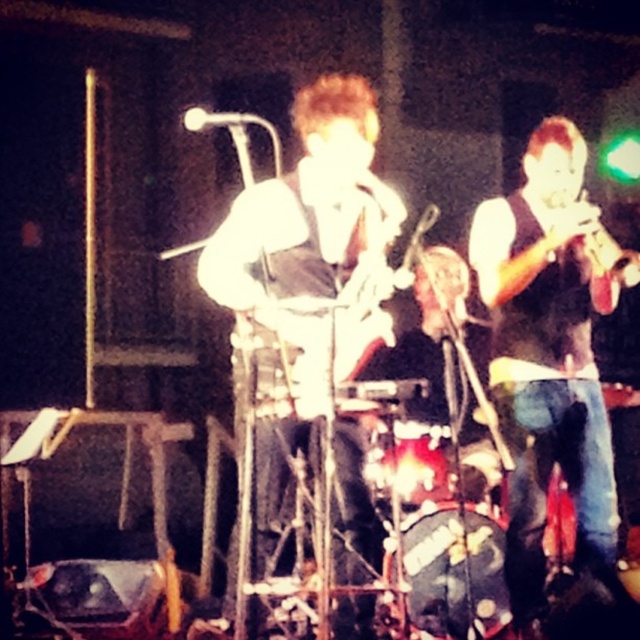
Question: Is white matte guitar at center to the right of metallic brass trumpet at upper right from the viewer's perspective?

Choices:
 (A) yes
 (B) no

Answer: (B)

Question: Which object appears farthest from the camera in this image?

Choices:
 (A) shiny black guitar at center
 (B) metallic brass trumpet at upper right
 (C) black matte vest at right
 (D) white matte guitar at center

Answer: (B)

Question: Does black matte vest at right appear on the left side of metallic brass trumpet at upper right?

Choices:
 (A) no
 (B) yes

Answer: (B)

Question: Can you confirm if black matte vest at right is bigger than shiny black guitar at center?

Choices:
 (A) yes
 (B) no

Answer: (A)

Question: Based on their relative distances, which object is nearer to the white matte guitar at center?

Choices:
 (A) black matte vest at right
 (B) metallic brass trumpet at upper right

Answer: (A)

Question: Among these points, which one is nearest to the camera?

Choices:
 (A) (529, 356)
 (B) (280, 285)
 (C) (556, 204)
 (D) (308, 124)

Answer: (B)